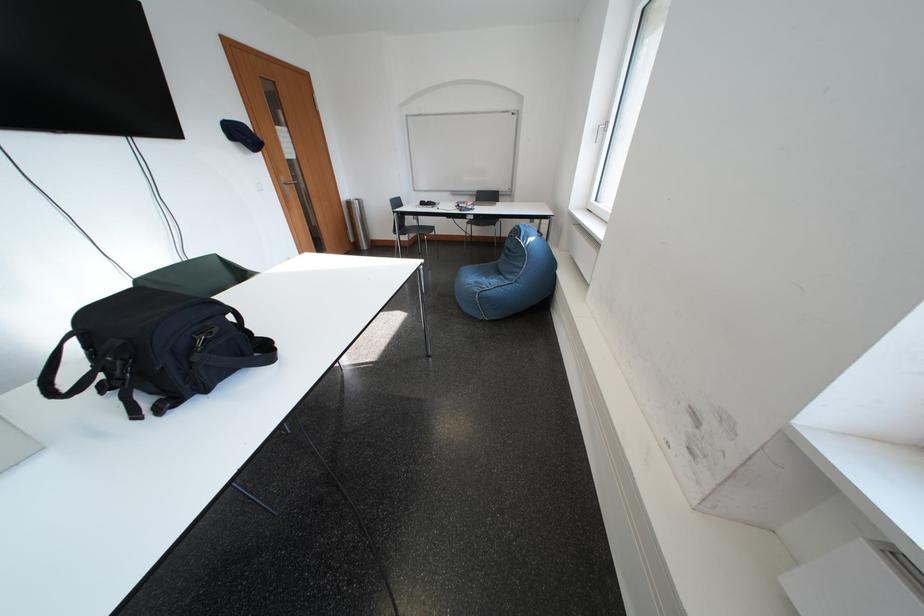
The image size is (924, 616). Describe the element at coordinates (480, 276) in the screenshot. I see `a sofa sitting surface` at that location.